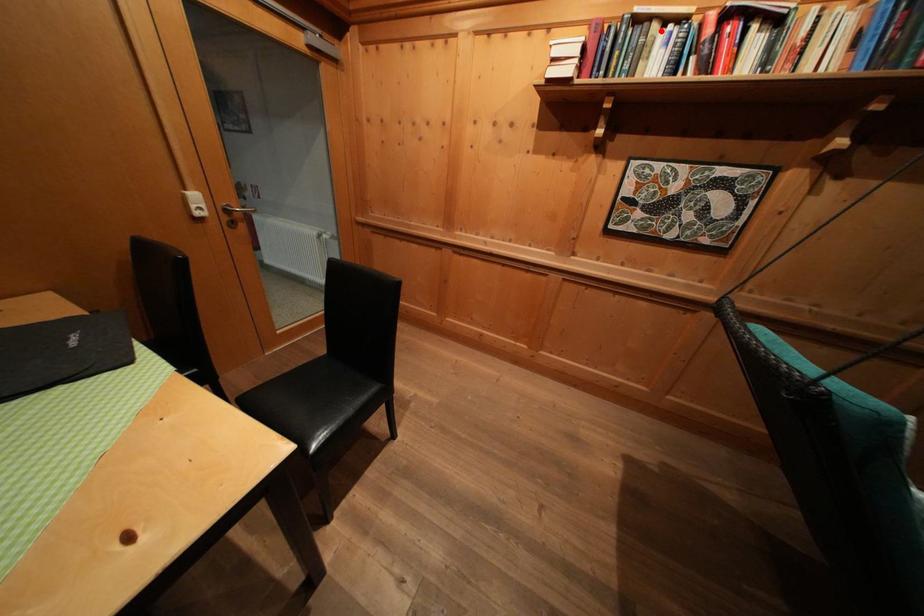
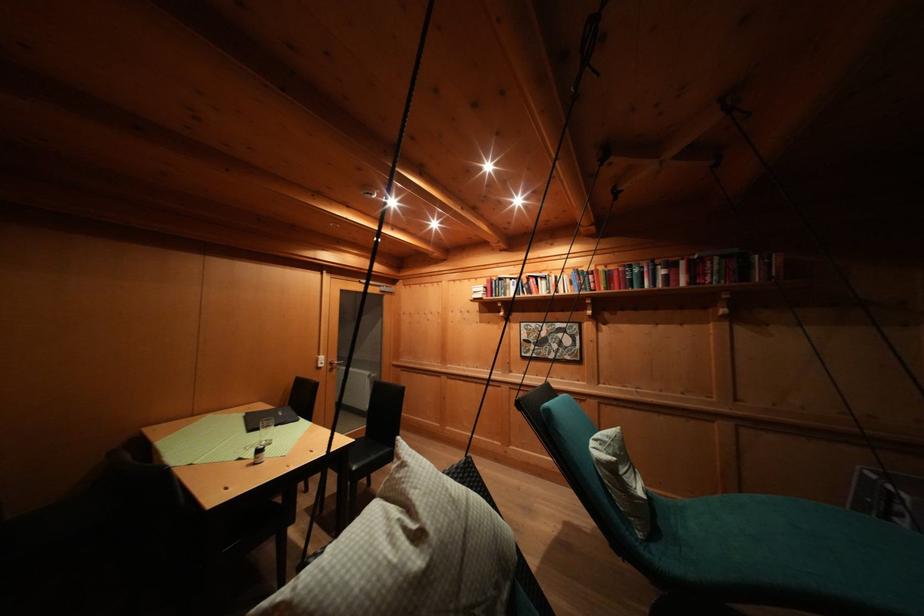
Where in the second image is the point corresponding to the highlighted location from the first image?

(514, 285)